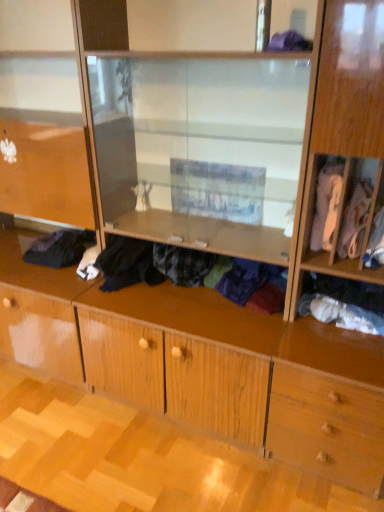
Question: Should I look upward or downward to see white fabric at right, acting as the third clothing starting from the right?

Choices:
 (A) up
 (B) down

Answer: (A)

Question: From a real-world perspective, is purple fabric at upper center, the 5th clothing positioned from the right, under white fabric at right, which ranks as the fourth clothing in left-to-right order?

Choices:
 (A) no
 (B) yes

Answer: (A)

Question: Considering the relative positions of purple fabric at upper center, which appears as the 3th clothing when viewed from the left, and white fabric at right, which ranks as the fourth clothing in left-to-right order, in the image provided, is purple fabric at upper center, which appears as the 3th clothing when viewed from the left, to the right of white fabric at right, which ranks as the fourth clothing in left-to-right order, from the viewer's perspective?

Choices:
 (A) no
 (B) yes

Answer: (A)

Question: Can you confirm if purple fabric at upper center, which appears as the 3th clothing when viewed from the left, is bigger than white fabric at right, the 4th clothing from the right?

Choices:
 (A) no
 (B) yes

Answer: (A)

Question: Can white fabric at right, which ranks as the fourth clothing in left-to-right order, be found inside purple fabric at upper center, which appears as the 3th clothing when viewed from the left?

Choices:
 (A) yes
 (B) no

Answer: (B)

Question: Is purple fabric at upper center, the 5th clothing positioned from the right, positioned far away from white fabric at right, which ranks as the fourth clothing in left-to-right order?

Choices:
 (A) yes
 (B) no

Answer: (B)

Question: Is purple fabric at upper center, the 5th clothing positioned from the right, facing towards white fabric at right, the 4th clothing from the right?

Choices:
 (A) yes
 (B) no

Answer: (B)

Question: Does white fabric at right, the 4th clothing from the right, have a greater width compared to dark blue fabric at center, marked as the sixth clothing in a right-to-left arrangement?

Choices:
 (A) yes
 (B) no

Answer: (B)

Question: Is white fabric at right, the 4th clothing from the right, outside of dark blue fabric at center, marked as the sixth clothing in a right-to-left arrangement?

Choices:
 (A) no
 (B) yes

Answer: (B)

Question: Could you tell me if white fabric at right, which ranks as the fourth clothing in left-to-right order, is turned towards dark blue fabric at center, marked as the sixth clothing in a right-to-left arrangement?

Choices:
 (A) no
 (B) yes

Answer: (A)

Question: Are white fabric at right, which ranks as the fourth clothing in left-to-right order, and dark blue fabric at center, marked as the sixth clothing in a right-to-left arrangement, far apart?

Choices:
 (A) no
 (B) yes

Answer: (A)

Question: Considering the relative positions of white fabric at right, the 4th clothing from the right, and dark blue fabric at center, the second clothing in the left-to-right sequence, in the image provided, is white fabric at right, the 4th clothing from the right, in front of dark blue fabric at center, the second clothing in the left-to-right sequence,?

Choices:
 (A) yes
 (B) no

Answer: (A)

Question: Is white fabric at right, the 4th clothing from the right, shorter than dark blue fabric at center, the second clothing in the left-to-right sequence?

Choices:
 (A) no
 (B) yes

Answer: (A)

Question: Considering the relative sizes of purple fabric at upper center, the 5th clothing positioned from the right, and white fabric at lower right, which appears as the 2th clothing when viewed from the right, in the image provided, is purple fabric at upper center, the 5th clothing positioned from the right, shorter than white fabric at lower right, which appears as the 2th clothing when viewed from the right,?

Choices:
 (A) no
 (B) yes

Answer: (B)